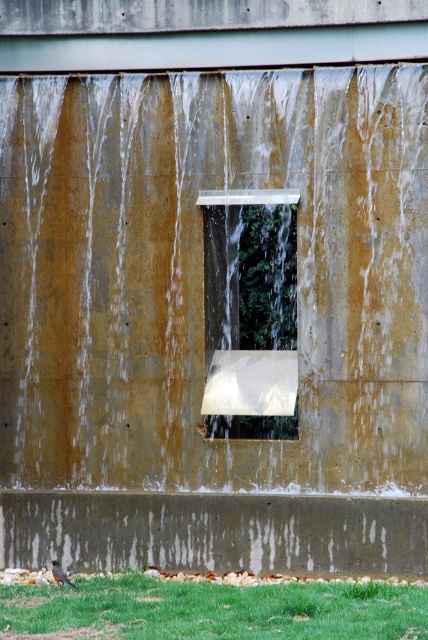
Who is more distant from viewer, (407, 106) or (2, 618)?

The point (407, 106) is more distant.

Which is in front, point (368, 268) or point (59, 600)?

Point (59, 600) is more forward.

Find the location of a particular element. clear concrete waterfall at center is located at coordinates (202, 275).

Can you confirm if green grass at lower center is bigger than clear glass window at center?

Yes.

Which is behind, point (26, 596) or point (282, 300)?

Point (282, 300)

Does point (335, 611) come in front of point (217, 284)?

Yes, point (335, 611) is in front of point (217, 284).

The width and height of the screenshot is (428, 640). Identify the location of green grass at lower center. (214, 609).

Who is positioned more to the left, clear concrete waterfall at center or concrete rough at lower center?

Positioned to the left is clear concrete waterfall at center.

Between clear concrete waterfall at center and concrete rough at lower center, which one has more height?

With more height is clear concrete waterfall at center.

Is point (67, 310) less distant than point (398, 516)?

No, (67, 310) is further to viewer.

At what (x,y) coordinates should I click in order to perform the action: click on clear concrete waterfall at center. Please return your answer as a coordinate pair (x, y). Looking at the image, I should click on (202, 275).